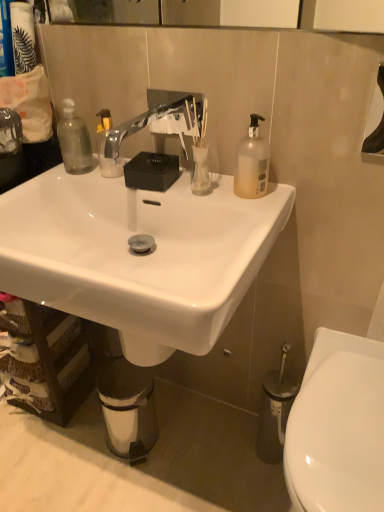
This screenshot has width=384, height=512. Identify the location of vacant space in front of metallic silver trash can at lower center. (125, 484).